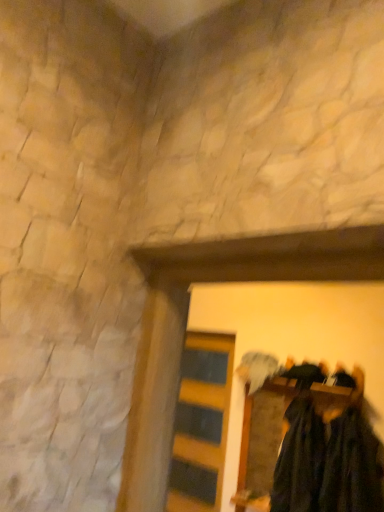
Question: Considering the relative sizes of yellow striped wood at center and dark green fuzzy sweater at lower right, arranged as the 1th clothing when viewed from the right, in the image provided, is yellow striped wood at center wider than dark green fuzzy sweater at lower right, arranged as the 1th clothing when viewed from the right,?

Choices:
 (A) no
 (B) yes

Answer: (A)

Question: Is yellow striped wood at center far away from dark green fuzzy sweater at lower right, arranged as the 1th clothing when viewed from the right?

Choices:
 (A) yes
 (B) no

Answer: (A)

Question: Is yellow striped wood at center smaller than dark green fuzzy sweater at lower right, the 2th clothing positioned from the left?

Choices:
 (A) no
 (B) yes

Answer: (B)

Question: From a real-world perspective, is yellow striped wood at center positioned under dark green fuzzy sweater at lower right, the 2th clothing positioned from the left, based on gravity?

Choices:
 (A) yes
 (B) no

Answer: (A)

Question: Is yellow striped wood at center further to the viewer compared to dark green fuzzy sweater at lower right, the 2th clothing positioned from the left?

Choices:
 (A) no
 (B) yes

Answer: (B)

Question: Looking at the image, does yellow striped wood at center seem bigger or smaller compared to dark green fabric at lower right, the first clothing in the left-to-right sequence?

Choices:
 (A) small
 (B) big

Answer: (A)

Question: From the image's perspective, is yellow striped wood at center located above or below dark green fabric at lower right, the first clothing in the left-to-right sequence?

Choices:
 (A) below
 (B) above

Answer: (A)

Question: Does point (180, 502) appear closer or farther from the camera than point (302, 495)?

Choices:
 (A) closer
 (B) farther

Answer: (B)

Question: Looking at their shapes, would you say yellow striped wood at center is wider or thinner than dark green fabric at lower right, the second clothing when ordered from right to left?

Choices:
 (A) wide
 (B) thin

Answer: (B)

Question: From the image's perspective, is yellow striped wood at center positioned above or below dark green fabric at center?

Choices:
 (A) above
 (B) below

Answer: (B)

Question: From a real-world perspective, is yellow striped wood at center physically located above or below dark green fabric at center?

Choices:
 (A) above
 (B) below

Answer: (B)

Question: In terms of size, does yellow striped wood at center appear bigger or smaller than dark green fabric at center?

Choices:
 (A) big
 (B) small

Answer: (B)

Question: Is yellow striped wood at center taller or shorter than dark green fabric at center?

Choices:
 (A) tall
 (B) short

Answer: (A)

Question: Is point (283, 498) positioned closer to the camera than point (354, 480)?

Choices:
 (A) closer
 (B) farther

Answer: (B)

Question: Is dark green fabric at lower right, the first clothing in the left-to-right sequence, to the left or to the right of dark green fuzzy sweater at lower right, the 2th clothing positioned from the left, in the image?

Choices:
 (A) right
 (B) left

Answer: (B)